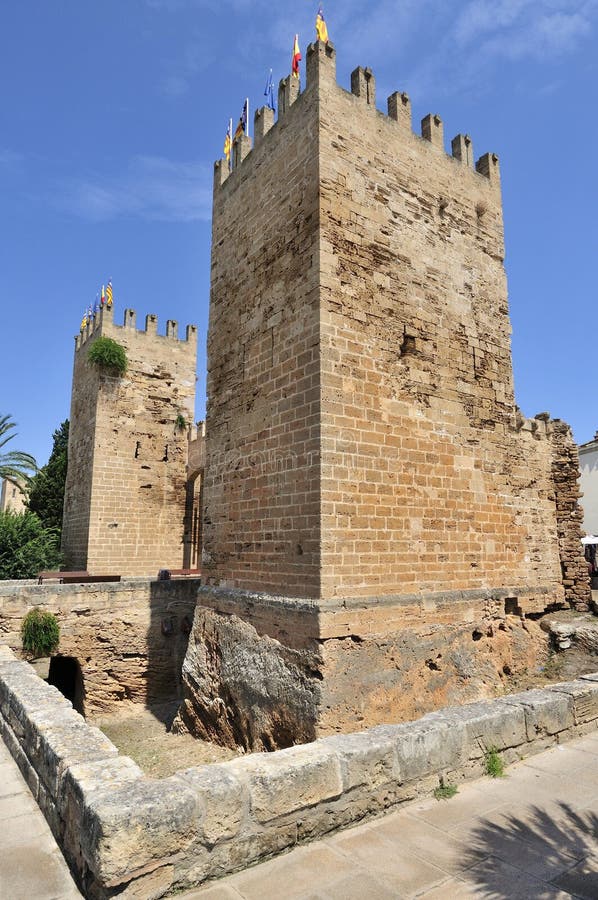
Image resolution: width=598 pixels, height=900 pixels. In order to click on white wall in this screenshot , I will do `click(596, 484)`.